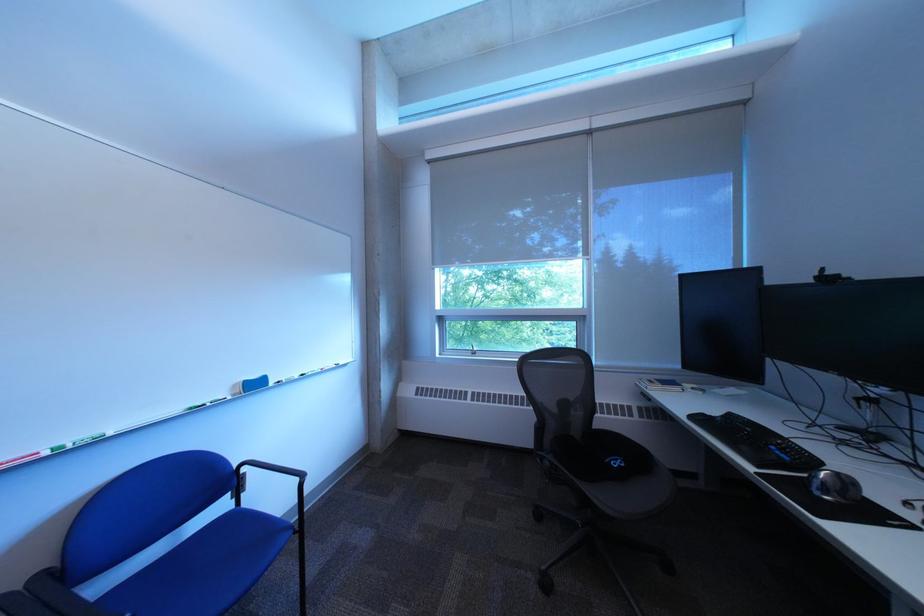
Where is `black chair sitting surface`? The width and height of the screenshot is (924, 616). black chair sitting surface is located at coordinates (601, 460).